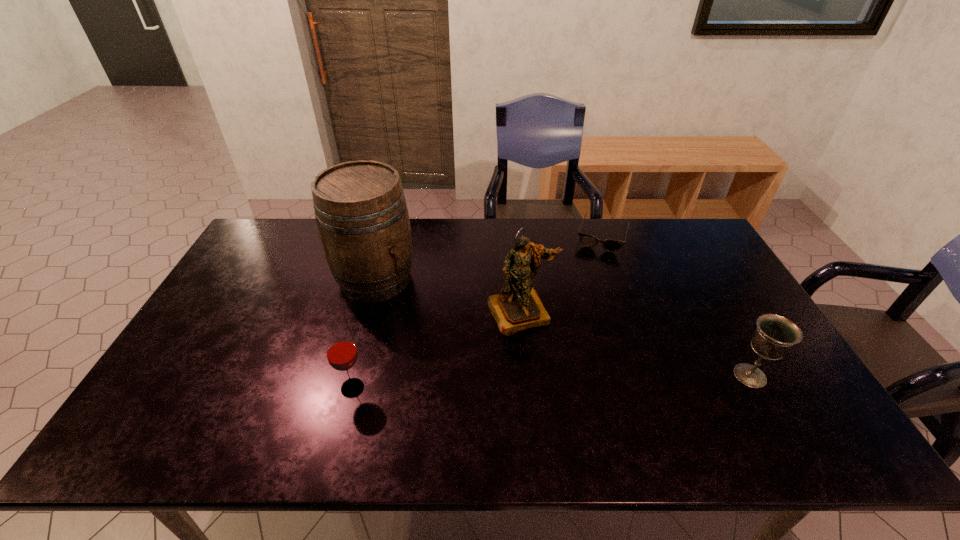
Find the location of a particular element. Image resolution: width=960 pixels, height=540 pixels. glass is located at coordinates 341,352.

This screenshot has height=540, width=960. I want to click on the rightmost object, so click(x=775, y=335).

You are a GUI agent. You are given a task and a screenshot of the screen. Output one action in this format:
    pyautogui.click(x=<x>, y=<y>)
    Task: Click on the cider
    This screenshot has width=960, height=540.
    Given the screenshot: What is the action you would take?
    pyautogui.click(x=361, y=212)

I want to click on the shortest object, so click(x=610, y=245).

Identify the location of sunglasses. (610, 245).

Locate an element on the screen. figurine is located at coordinates (518, 306).

Locate an element on the screen. the fourth shortest object is located at coordinates (518, 306).

This screenshot has height=540, width=960. I want to click on vacant space situated on the back of the glass, so click(x=370, y=319).

You are a GUI agent. You are given a task and a screenshot of the screen. Output one action in this format:
    pyautogui.click(x=<x>, y=<y>)
    Task: Click on the vacant region located on the back of the rightmost object
    This screenshot has height=540, width=960.
    Given the screenshot: What is the action you would take?
    pyautogui.click(x=726, y=333)

Identify the location of free space located 0.150m on the side of the tallest object near the bung hole. (432, 324).